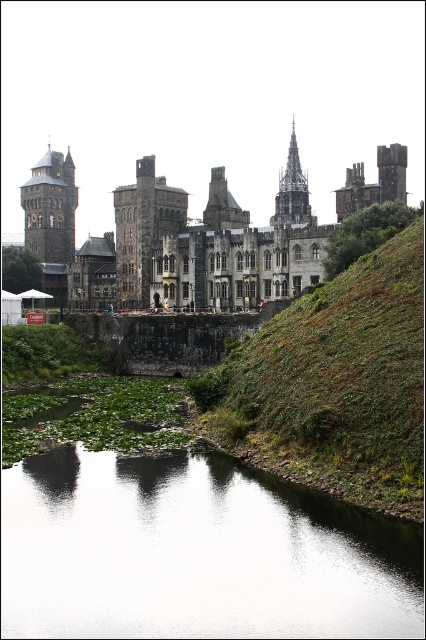
Question: Is the position of gray stone spire at upper center less distant than that of dark gray stone tower at upper right?

Choices:
 (A) yes
 (B) no

Answer: (A)

Question: Which point is farther to the camera?

Choices:
 (A) (123, 264)
 (B) (155, 257)
 (C) (293, 352)

Answer: (A)

Question: Which is farther from the stone castle at center?

Choices:
 (A) gray stone spire at upper center
 (B) brown stone tower at left
 (C) dark gray stone tower at upper right

Answer: (C)

Question: Which object is farther from the camera taking this photo?

Choices:
 (A) stone castle at center
 (B) transparent water at center

Answer: (A)

Question: Is brown stone tower at left to the right of dark gray stone tower at upper right from the viewer's perspective?

Choices:
 (A) no
 (B) yes

Answer: (A)

Question: Is brown stone tower at left above gray stone spire at upper center?

Choices:
 (A) yes
 (B) no

Answer: (A)